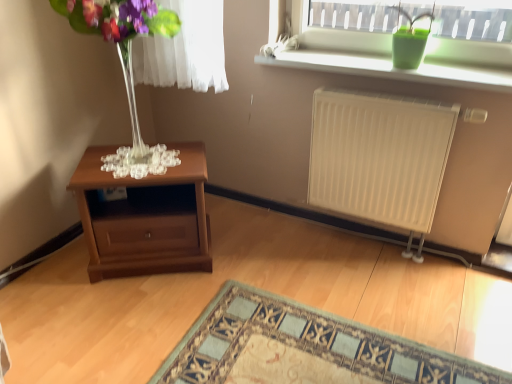
The width and height of the screenshot is (512, 384). I want to click on vacant space underneath white matte radiator at right (from a real-world perspective), so click(x=386, y=241).